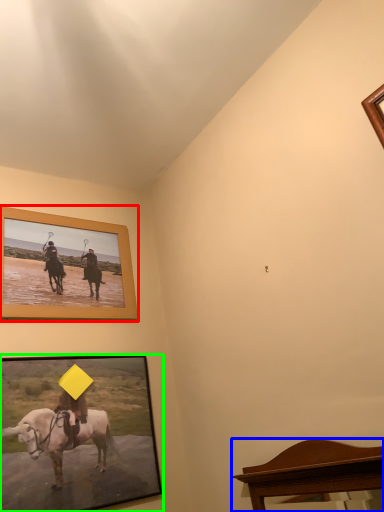
Question: Considering the real-world distances, which object is farthest from picture frame (highlighted by a red box)? furniture (highlighted by a blue box) or picture frame (highlighted by a green box)?

Choices:
 (A) furniture
 (B) picture frame

Answer: (A)